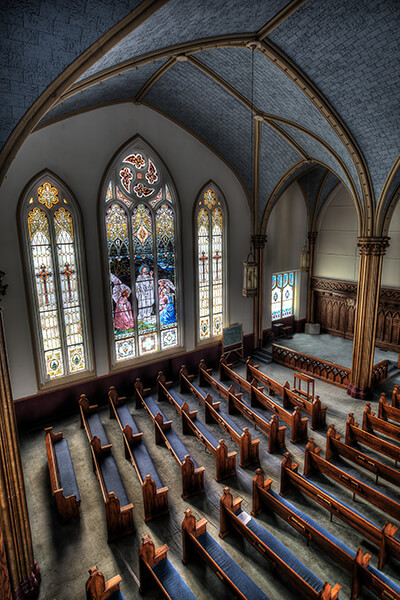
You are a GUI agent. You are given a task and a screenshot of the screen. Output one action in this format:
    pyautogui.click(x=<x>, y=<y>)
    Task: Click on the ceiling
    
    Given the screenshot: What is the action you would take?
    pyautogui.click(x=341, y=60)